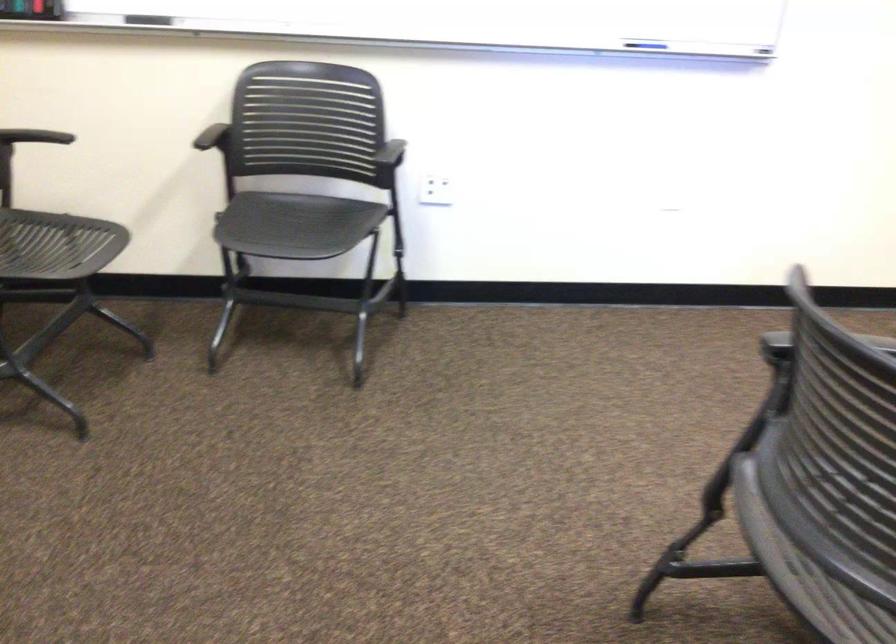
The height and width of the screenshot is (644, 896). I want to click on whiteboard eraser, so click(148, 20).